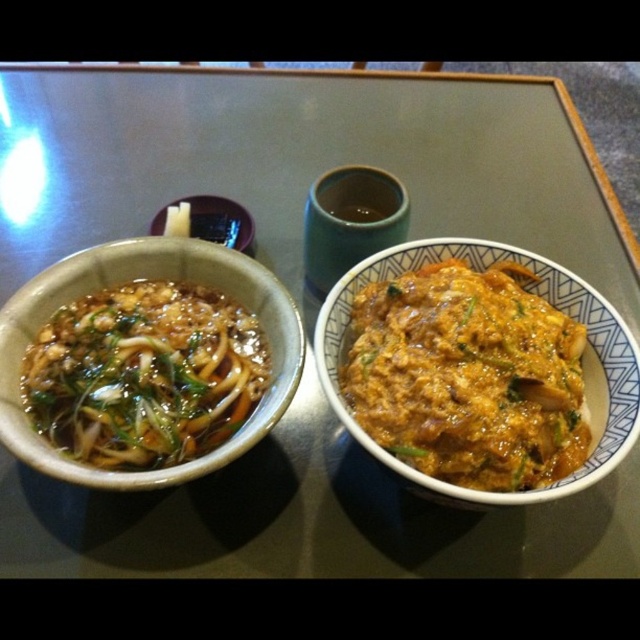
You are a food delivery robot with a 30 cm wide tray. You need to place a new dish between the slightly glossy noodles at left and the matte ceramic bowl at center. Can your tray fit between them without touching either object?

The distance between the slightly glossy noodles at left and the matte ceramic bowl at center is 32.00 centimeters. Since your tray is 30 cm wide, there is enough space to place it between them without touching either object.

You are standing in front of a table with two bowls and a cup. You want to pick up the cup located at point [186,289]. If your hand can reach up to 1 meter, can you safely grab it without stretching too far?

The distance of point [186,289] from the camera is 1.07 meters, so your hand can not safely grab it without stretching since it is slightly further than the maximum reach of 1 meter.

You are a food delivery person who needs to pack these items into a box. The box can only fit one large item. Which item should you choose between the slightly glossy noodles at left and the matte ceramic bowl at center?

The slightly glossy noodles at left is larger in size than the matte ceramic bowl at center, so you should choose the slightly glossy noodles at left to fit into the box.